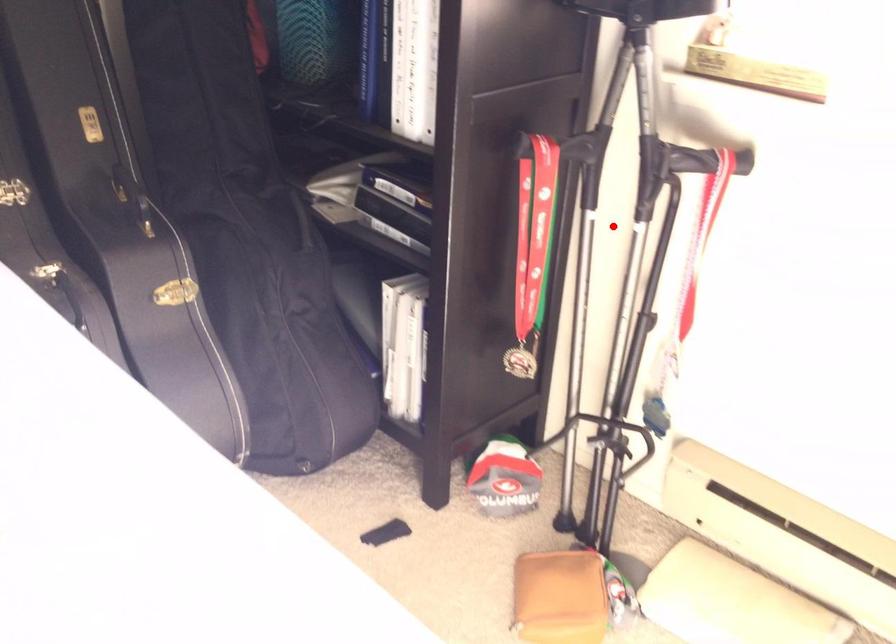
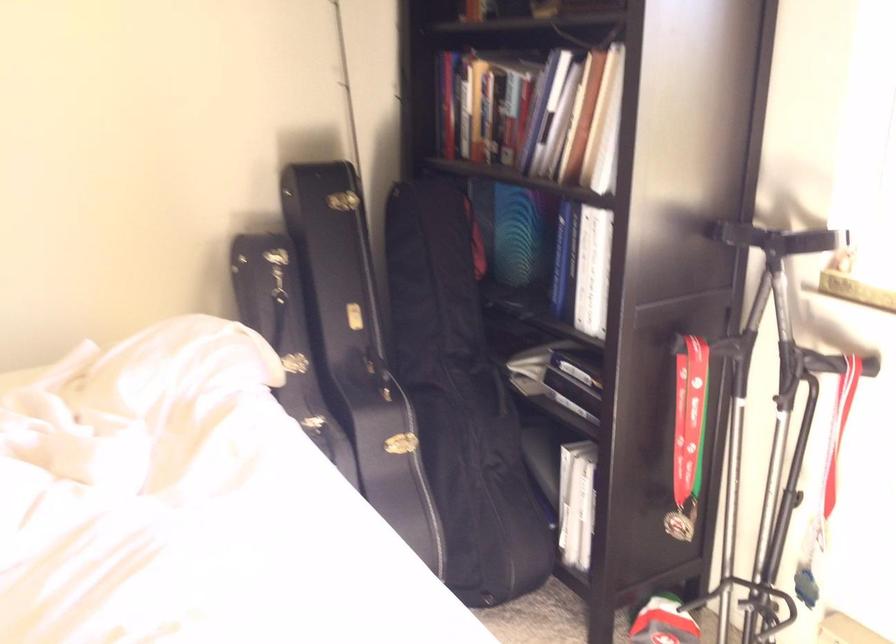
Question: I am providing you with two images of the same scene from different viewpoints. A red point is shown in image1. For the corresponding object point in image2, is it positioned nearer or farther from the camera?

Choices:
 (A) Nearer
 (B) Farther

Answer: (B)